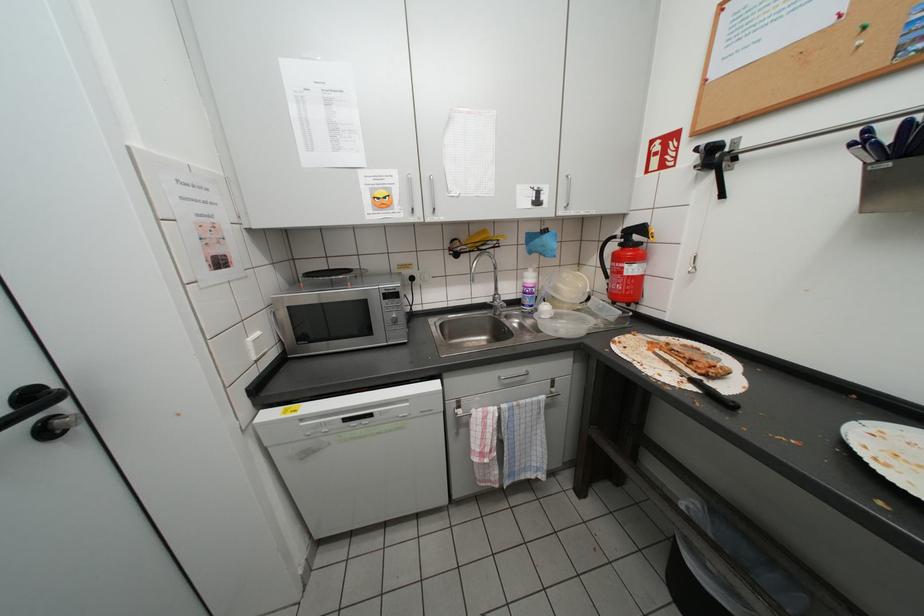
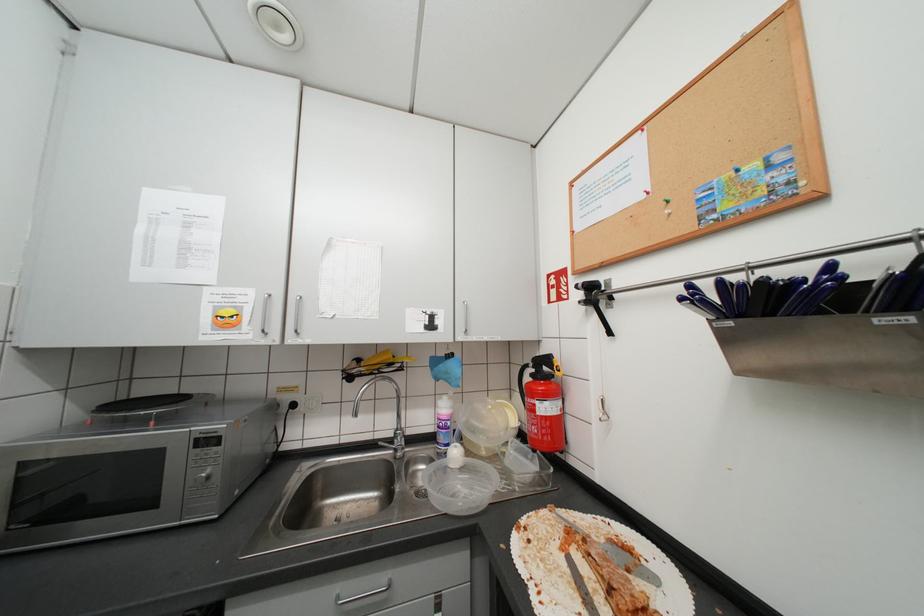
Question: What movement of the cameraman would produce the second image?

Choices:
 (A) Left
 (B) Right
 (C) Forward
 (D) Backward

Answer: (B)